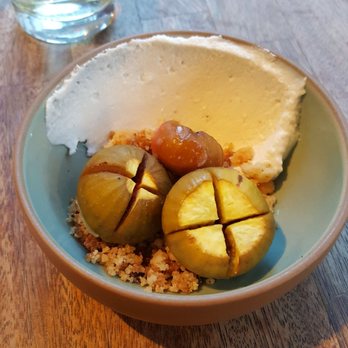
Locate an element on the screen. The width and height of the screenshot is (348, 348). brown bowl is located at coordinates (111, 294).